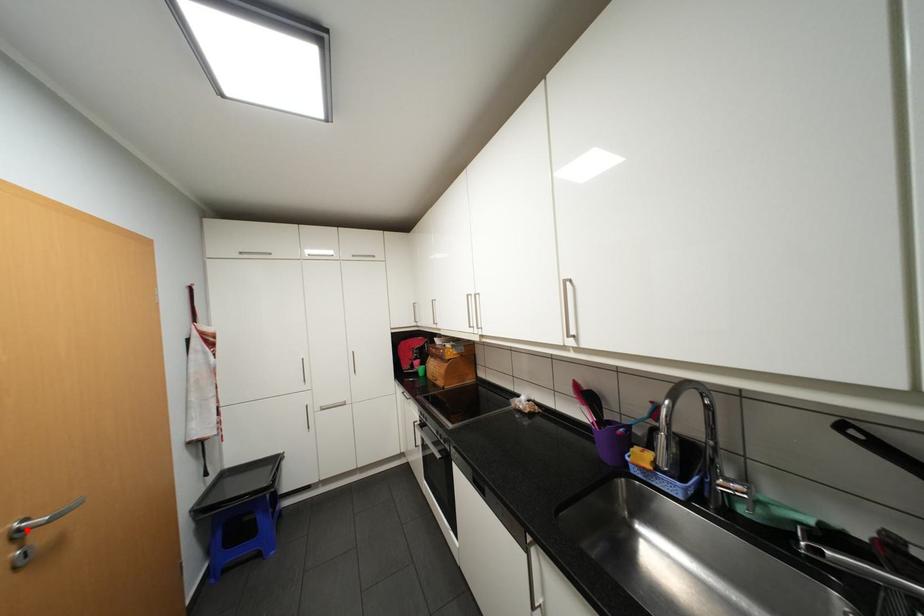
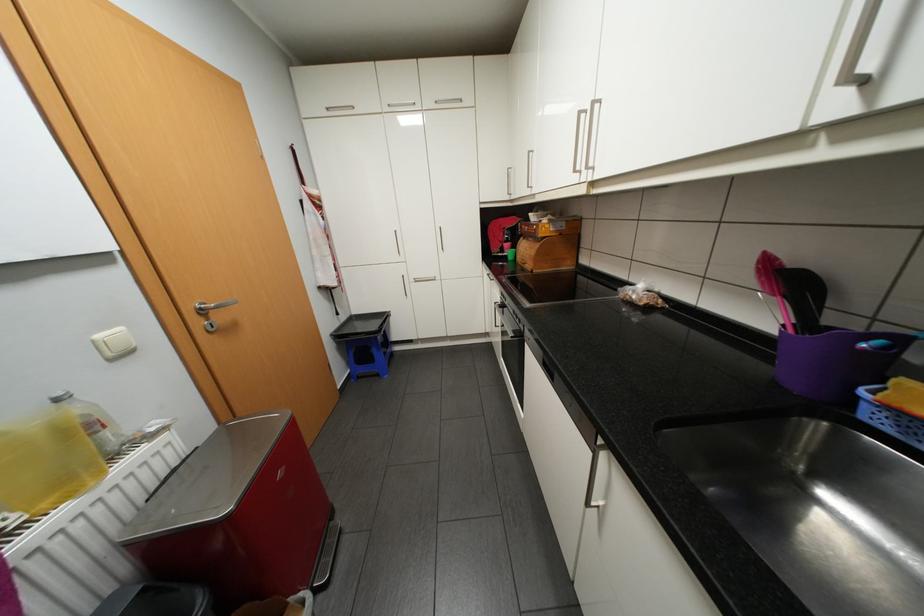
Locate, in the second image, the point that corresponds to the highlighted location in the first image.

(209, 308)